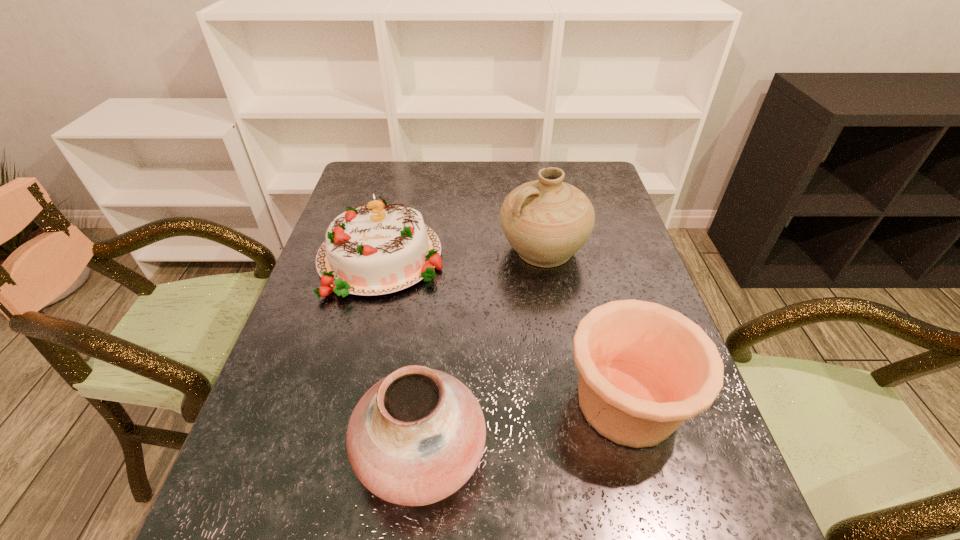
The width and height of the screenshot is (960, 540). I want to click on vacant space at the right edge, so click(x=628, y=241).

In order to click on vacant space at the far left corner of the desktop in this screenshot , I will do `click(397, 180)`.

Find the location of `vacant space at the far right corner of the desktop`. vacant space at the far right corner of the desktop is located at coordinates (603, 186).

Find the location of a particular element. This screenshot has width=960, height=540. empty space between the cake and the farthest pottery is located at coordinates (462, 254).

Where is `vacant area between the leftmost pottery and the cake`? Image resolution: width=960 pixels, height=540 pixels. vacant area between the leftmost pottery and the cake is located at coordinates (x=401, y=354).

Where is `vacant space that's between the tallest object and the cake`? This screenshot has height=540, width=960. vacant space that's between the tallest object and the cake is located at coordinates (462, 254).

The image size is (960, 540). In order to click on empty space between the farthest pottery and the leftmost pottery in this screenshot , I will do `click(482, 350)`.

Choose which object is the second nearest neighbor to the cake. Please provide its 2D coordinates. Your answer should be formatted as a tuple, i.e. [(x, y)], where the tuple contains the x and y coordinates of a point satisfying the conditions above.

[(415, 437)]

Identify which object is the third nearest to the cake. Please provide its 2D coordinates. Your answer should be formatted as a tuple, i.e. [(x, y)], where the tuple contains the x and y coordinates of a point satisfying the conditions above.

[(643, 369)]

I want to click on pottery that stands as the closest to the leftmost pottery, so click(643, 369).